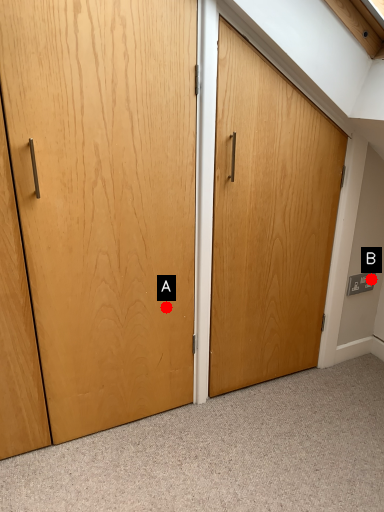
Question: Two points are circled on the image, labeled by A and B beside each circle. Among these points, which one is nearest to the camera?

Choices:
 (A) A is closer
 (B) B is closer

Answer: (A)